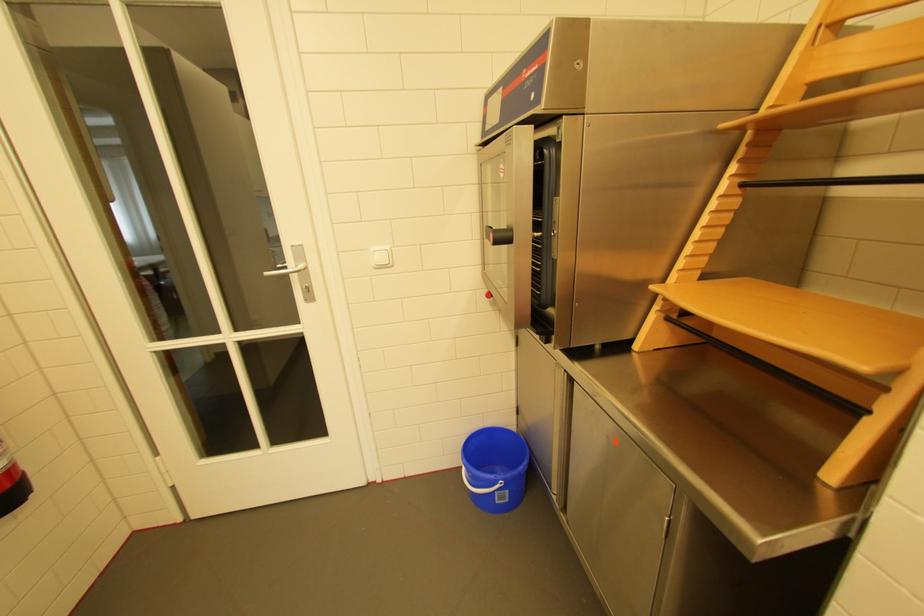
What do you see at coordinates (381, 257) in the screenshot? The width and height of the screenshot is (924, 616). I see `the white light switch` at bounding box center [381, 257].